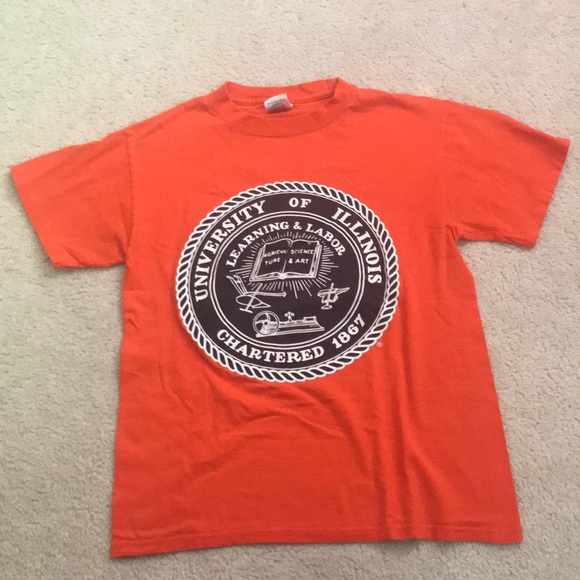
What are the coordinates of `carpet` in the screenshot? It's located at (542, 302).